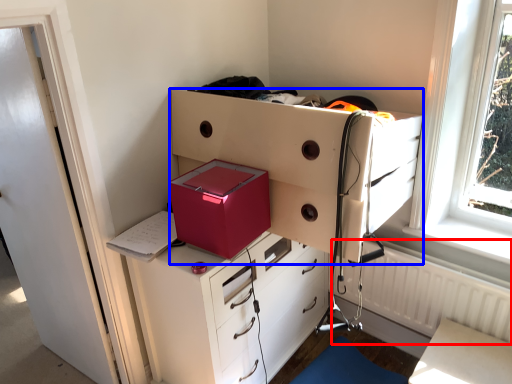
Question: Among these objects, which one is nearest to the camera, radiator (highlighted by a red box) or chest of drawers (highlighted by a blue box)?

Choices:
 (A) radiator
 (B) chest of drawers

Answer: (B)